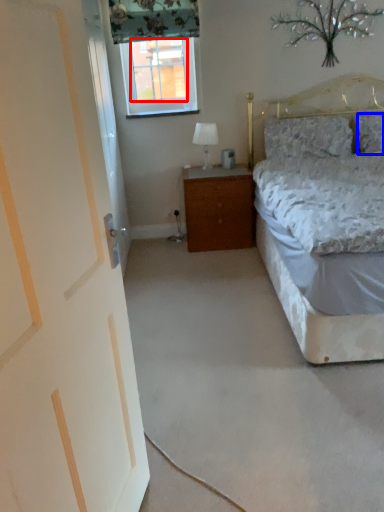
Question: Which point is further to the camera, window screen (highlighted by a red box) or pillow (highlighted by a blue box)?

Choices:
 (A) window screen
 (B) pillow

Answer: (A)